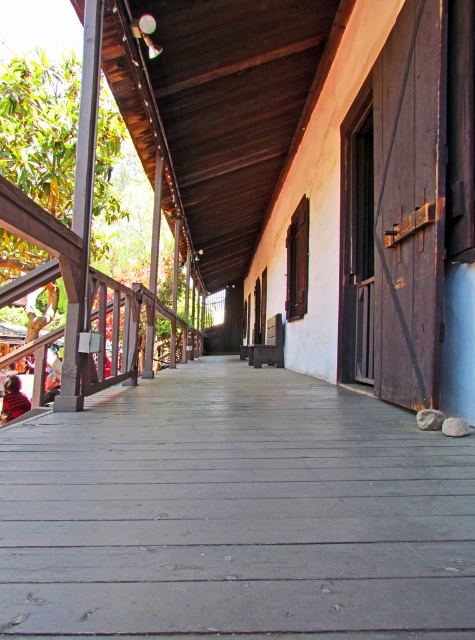
Question: Which point appears farthest from the camera in this image?

Choices:
 (A) (28, 408)
 (B) (425, 461)

Answer: (A)

Question: Where is smooth gray wood porch at center located in relation to red sweater at lower left in the image?

Choices:
 (A) below
 (B) above

Answer: (B)

Question: Where is smooth gray wood porch at center located in relation to red sweater at lower left in the image?

Choices:
 (A) right
 (B) left

Answer: (A)

Question: Among these points, which one is nearest to the camera?

Choices:
 (A) (8, 412)
 (B) (101, 595)

Answer: (B)

Question: Is smooth gray wood porch at center thinner than red sweater at lower left?

Choices:
 (A) no
 (B) yes

Answer: (A)